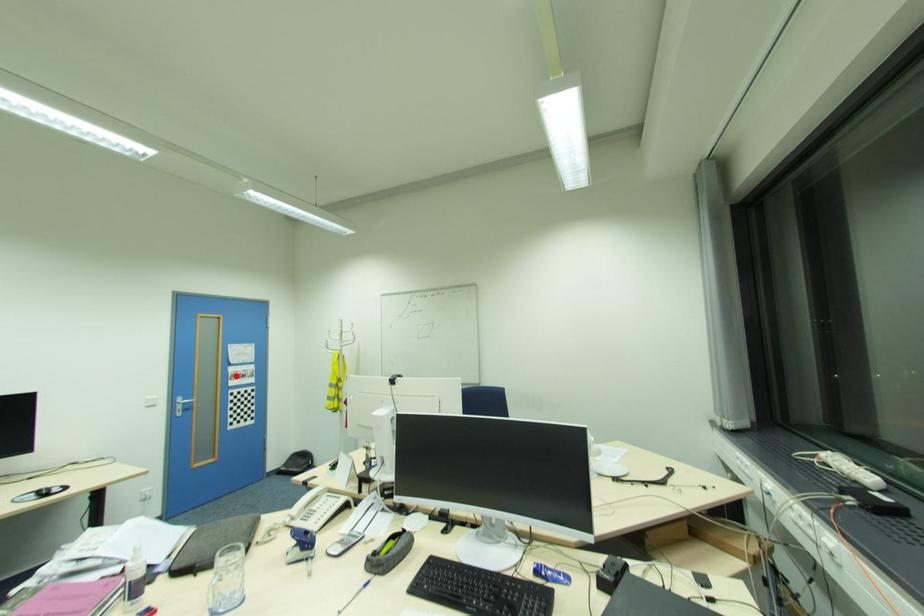
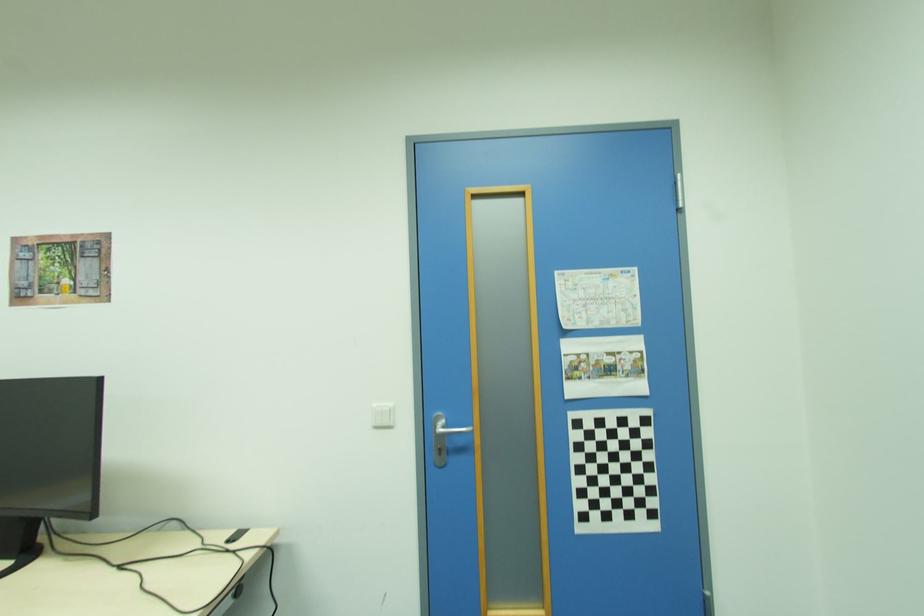
In the second image, find the point that corresponds to the highlighted location in the first image.

(579, 369)